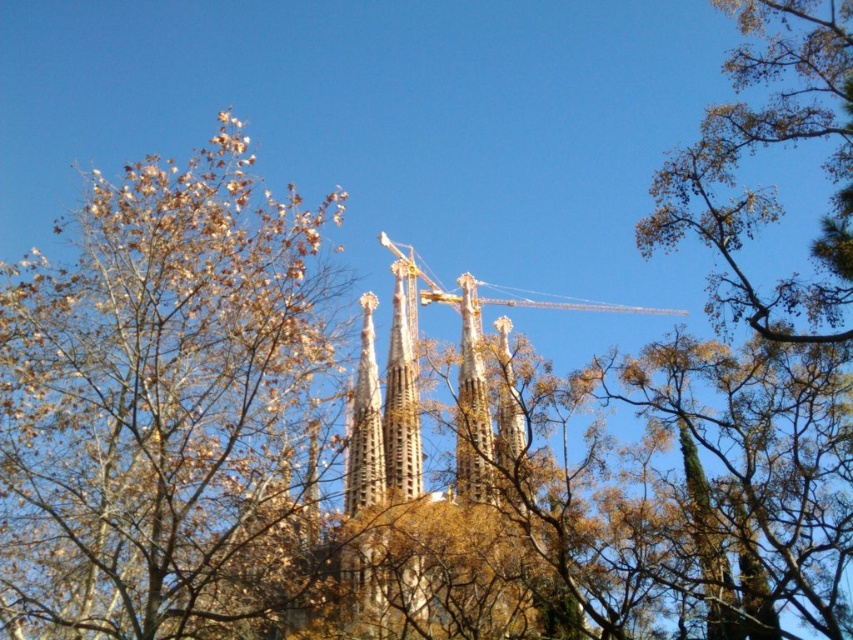
Question: Is brown leafy tree at upper right below golden stone spire at center?

Choices:
 (A) no
 (B) yes

Answer: (A)

Question: Which of the following is the closest to the observer?

Choices:
 (A) (471, 413)
 (B) (814, 17)

Answer: (B)

Question: Which point is closer to the camera?

Choices:
 (A) golden stone spire at center
 (B) brown leafy tree at upper right
 (C) brown leafy tree at upper left

Answer: (C)

Question: Does brown leafy tree at upper left come behind brown leafy tree at upper right?

Choices:
 (A) no
 (B) yes

Answer: (A)

Question: Where is brown leafy tree at upper left located in relation to brown leafy tree at upper right in the image?

Choices:
 (A) left
 (B) right

Answer: (A)

Question: Which point is farther from the camera taking this photo?

Choices:
 (A) 460,369
 (B) 242,500

Answer: (A)